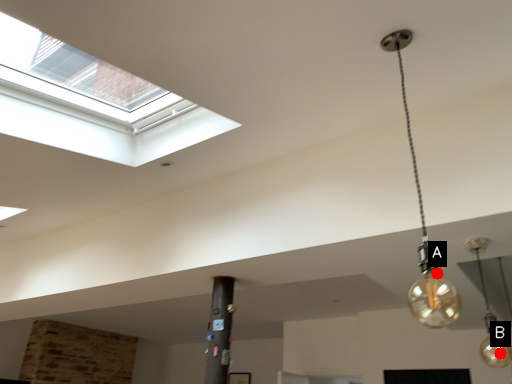
Question: Two points are circled on the image, labeled by A and B beside each circle. Which point is farther from the camera taking this photo?

Choices:
 (A) A is further
 (B) B is further

Answer: (B)